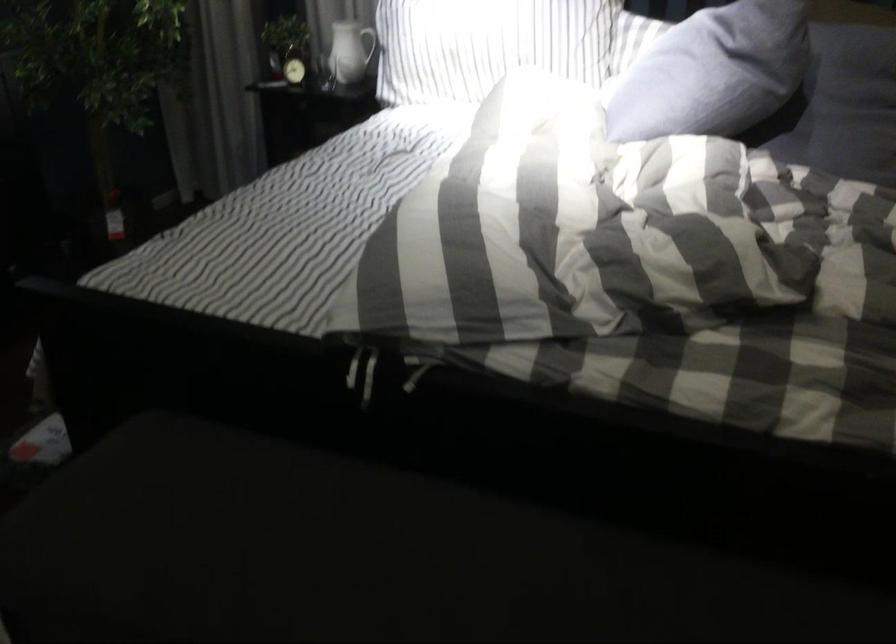
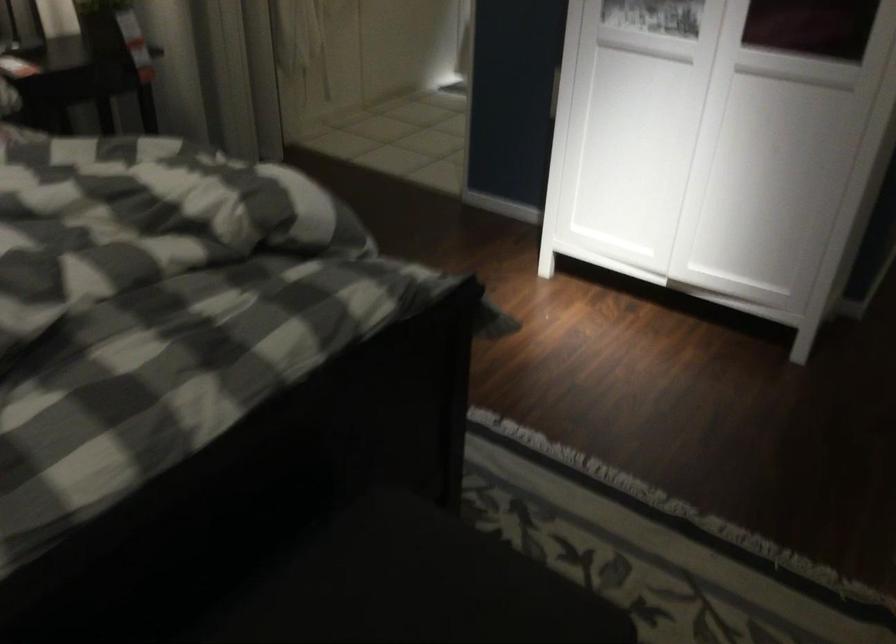
How did the camera likely rotate?

The camera rotated toward right-down.